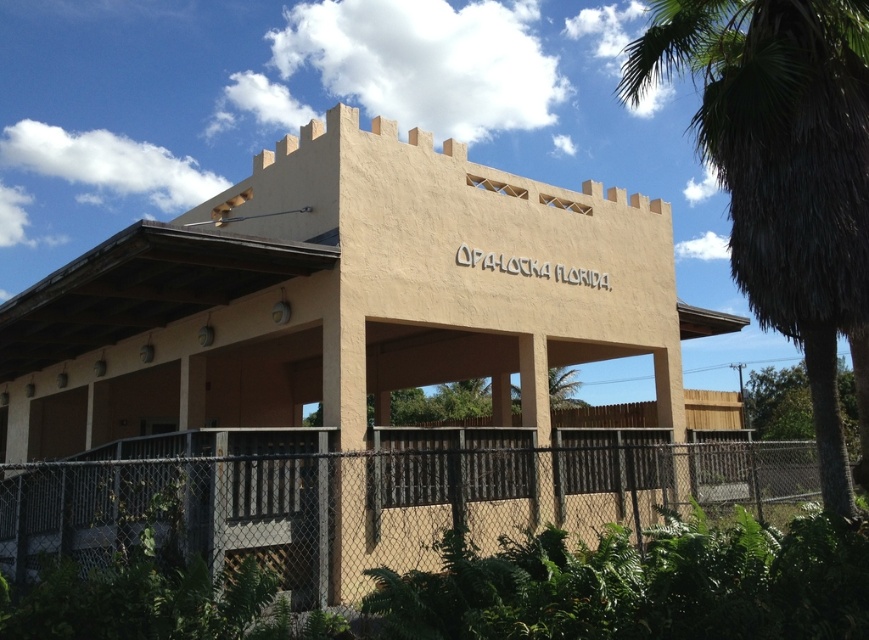
You are standing at the entrance of the building marked by the open archway. You notice two points marked on the ground. One is labeled as point (x=381, y=541) and the other as point (x=667, y=48). Which point is farther away from you?

Point (x=381, y=541) is behind point (x=667, y=48), so it is farther away from you.